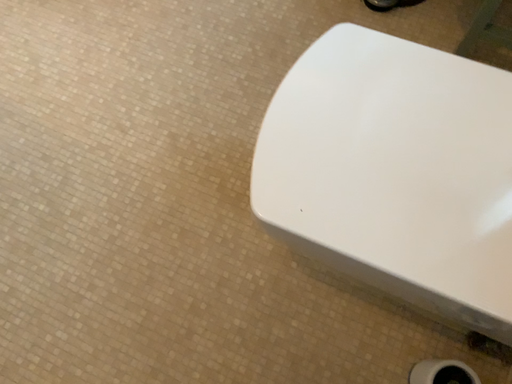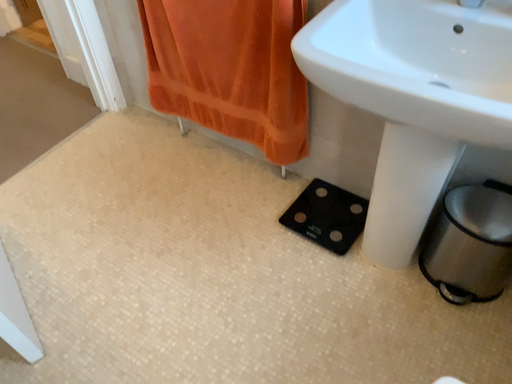
Question: How did the camera likely rotate when shooting the video?

Choices:
 (A) rotated downward
 (B) rotated upward

Answer: (B)